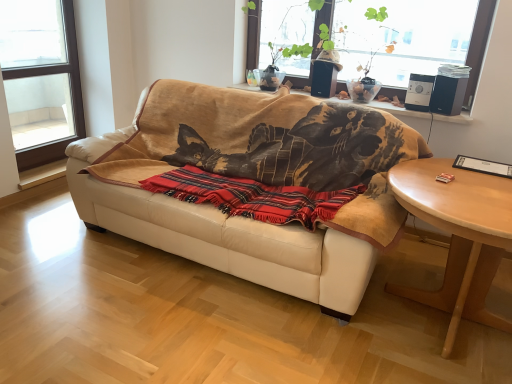
I want to click on beige leather couch at center, so click(241, 217).

You are a GUI agent. You are given a task and a screenshot of the screen. Output one action in this format:
    pyautogui.click(x=<x>, y=<y>)
    Task: Click on the transparent glass window at upper left, the 2th window positioned from the right
    The height and width of the screenshot is (384, 512).
    Given the screenshot: What is the action you would take?
    pyautogui.click(x=69, y=94)

How much space does transparent glass window at upper left, the 2th window positioned from the right, occupy horizontally?

It is 4.31 inches.

This screenshot has height=384, width=512. Identify the location of transparent glass window at upper center, acting as the first window starting from the right. (479, 42).

What is the approximate width of light brown wooden coffee table at lower right?

light brown wooden coffee table at lower right is 3.44 feet in width.

Describe the element at coordinates (252, 196) in the screenshot. I see `red plaid blanket at center` at that location.

Locate an element on the screen. The height and width of the screenshot is (384, 512). wooden window sill at upper center is located at coordinates (399, 110).

Find the location of a particular element. beige leather couch at center is located at coordinates (241, 217).

From a real-world perspective, who is located higher, beige leather couch at center or transparent glass window at upper left, which is counted as the 1th window, starting from the left?

In real-world perspective, transparent glass window at upper left, which is counted as the 1th window, starting from the left, is above.

Is beige leather couch at center in contact with transparent glass window at upper left, which is counted as the 1th window, starting from the left?

No, beige leather couch at center is not touching transparent glass window at upper left, which is counted as the 1th window, starting from the left.

Is beige leather couch at center turned away from transparent glass window at upper left, which is counted as the 1th window, starting from the left?

No, beige leather couch at center is not facing away from transparent glass window at upper left, which is counted as the 1th window, starting from the left.

Can you confirm if transparent glass window at upper left, which is counted as the 1th window, starting from the left, is positioned to the right of wooden window sill at upper center?

In fact, transparent glass window at upper left, which is counted as the 1th window, starting from the left, is to the left of wooden window sill at upper center.

Are transparent glass window at upper left, the 2th window positioned from the right, and wooden window sill at upper center making contact?

There is a gap between transparent glass window at upper left, the 2th window positioned from the right, and wooden window sill at upper center.

Measure the distance from transparent glass window at upper left, the 2th window positioned from the right, to wooden window sill at upper center.

transparent glass window at upper left, the 2th window positioned from the right, and wooden window sill at upper center are 2.78 meters apart from each other.

From a real-world perspective, between transparent glass window at upper left, the 2th window positioned from the right, and red plaid blanket at center, who is vertically higher?

transparent glass window at upper left, the 2th window positioned from the right, from a real-world perspective.

Considering the relative sizes of transparent glass window at upper left, the 2th window positioned from the right, and red plaid blanket at center in the image provided, is transparent glass window at upper left, the 2th window positioned from the right, thinner than red plaid blanket at center?

Yes, transparent glass window at upper left, the 2th window positioned from the right, is thinner than red plaid blanket at center.

Does point (12, 2) lie behind point (276, 203)?

Yes, point (12, 2) is farther from viewer.

Is point (502, 184) positioned before point (361, 229)?

No, it is behind (361, 229).

Is light brown wooden coffee table at lower right shorter than beige leather couch at center?

Yes.

The height and width of the screenshot is (384, 512). What are the coordinates of `studio couch above the light brown wooden coffee table at lower right (from a real-world perspective)` in the screenshot? It's located at (241, 217).

Does light brown wooden coffee table at lower right have a smaller size compared to beige leather couch at center?

Yes.

Is wooden window sill at upper center facing away from transparent glass window at upper left, which is counted as the 1th window, starting from the left?

No, transparent glass window at upper left, which is counted as the 1th window, starting from the left, is not at the back of wooden window sill at upper center.

Is the depth of wooden window sill at upper center greater than that of transparent glass window at upper left, which is counted as the 1th window, starting from the left?

That is False.

How many degrees apart are the facing directions of wooden window sill at upper center and transparent glass window at upper left, the 2th window positioned from the right?

The angle between the facing direction of wooden window sill at upper center and the facing direction of transparent glass window at upper left, the 2th window positioned from the right, is 89.6 degrees.

Considering the sizes of wooden window sill at upper center and transparent glass window at upper left, the 2th window positioned from the right, in the image, is wooden window sill at upper center bigger or smaller than transparent glass window at upper left, the 2th window positioned from the right,?

wooden window sill at upper center is smaller than transparent glass window at upper left, the 2th window positioned from the right.

From a real-world perspective, which is physically below, light brown wooden coffee table at lower right or transparent glass window at upper left, the 2th window positioned from the right?

light brown wooden coffee table at lower right, from a real-world perspective.

Does point (489, 185) lie behind point (46, 142)?

No, (489, 185) is closer to viewer.

Based on the photo, considering the relative sizes of light brown wooden coffee table at lower right and transparent glass window at upper left, the 2th window positioned from the right, in the image provided, is light brown wooden coffee table at lower right bigger than transparent glass window at upper left, the 2th window positioned from the right,?

Indeed, light brown wooden coffee table at lower right has a larger size compared to transparent glass window at upper left, the 2th window positioned from the right.

From the picture: From the image's perspective, which one is positioned higher, wooden window sill at upper center or red plaid blanket at center?

wooden window sill at upper center.

Relative to red plaid blanket at center, is wooden window sill at upper center in front or behind?

In the image, wooden window sill at upper center appears behind red plaid blanket at center.

Consider the image. From a real-world perspective, is wooden window sill at upper center over red plaid blanket at center?

Yes.

Considering the sizes of objects wooden window sill at upper center and red plaid blanket at center in the image provided, who is smaller, wooden window sill at upper center or red plaid blanket at center?

Smaller between the two is wooden window sill at upper center.

The width and height of the screenshot is (512, 384). What are the coordinates of `studio couch directly beneath the transparent glass window at upper left, which is counted as the 1th window, starting from the left (from a real-world perspective)` in the screenshot? It's located at (241, 217).

The width and height of the screenshot is (512, 384). I want to click on window on the left of wooden window sill at upper center, so click(69, 94).

Considering their positions, is light brown wooden coffee table at lower right positioned further to transparent glass window at upper left, the 2th window positioned from the right, than wooden window sill at upper center?

light brown wooden coffee table at lower right is positioned further to the anchor transparent glass window at upper left, the 2th window positioned from the right.

When comparing their distances from transparent glass window at upper left, which is counted as the 1th window, starting from the left, does red plaid blanket at center or wooden window sill at upper center seem further?

wooden window sill at upper center is positioned further to the anchor transparent glass window at upper left, which is counted as the 1th window, starting from the left.

Which object lies further to the anchor point transparent glass window at upper center, which is the 2th window from left to right, light brown wooden coffee table at lower right or transparent glass window at upper left, the 2th window positioned from the right?

transparent glass window at upper left, the 2th window positioned from the right.

From the image, which object appears to be farther from red plaid blanket at center, transparent glass window at upper left, the 2th window positioned from the right, or wooden window sill at upper center?

transparent glass window at upper left, the 2th window positioned from the right, lies further to red plaid blanket at center than the other object.

Based on their spatial positions, is transparent glass window at upper center, which is the 2th window from left to right, or transparent glass window at upper left, which is counted as the 1th window, starting from the left, closer to beige leather couch at center?

transparent glass window at upper center, which is the 2th window from left to right.

Considering their positions, is beige leather couch at center positioned further to red plaid blanket at center than wooden window sill at upper center?

Based on the image, wooden window sill at upper center appears to be further to red plaid blanket at center.

Looking at the image, which one is located closer to transparent glass window at upper center, acting as the first window starting from the right, beige leather couch at center or transparent glass window at upper left, which is counted as the 1th window, starting from the left?

beige leather couch at center is positioned closer to the anchor transparent glass window at upper center, acting as the first window starting from the right.

Looking at the image, which one is located closer to light brown wooden coffee table at lower right, transparent glass window at upper center, acting as the first window starting from the right, or red plaid blanket at center?

red plaid blanket at center.

You are a GUI agent. You are given a task and a screenshot of the screen. Output one action in this format:
    pyautogui.click(x=<x>, y=<y>)
    Task: Click on the studio couch between transparent glass window at upper left, the 2th window positioned from the right, and wooden window sill at upper center
    
    Given the screenshot: What is the action you would take?
    pyautogui.click(x=241, y=217)

At what (x,y) coordinates should I click in order to perform the action: click on studio couch between transparent glass window at upper center, acting as the first window starting from the right, and light brown wooden coffee table at lower right, in the vertical direction. Please return your answer as a coordinate pair (x, y). This screenshot has width=512, height=384. Looking at the image, I should click on pos(241,217).

Where is `window sill between transparent glass window at upper center, which is the 2th window from left to right, and light brown wooden coffee table at lower right in the up-down direction`? Image resolution: width=512 pixels, height=384 pixels. window sill between transparent glass window at upper center, which is the 2th window from left to right, and light brown wooden coffee table at lower right in the up-down direction is located at coordinates (399, 110).

You are a GUI agent. You are given a task and a screenshot of the screen. Output one action in this format:
    pyautogui.click(x=<x>, y=<y>)
    Task: Click on the studio couch between transparent glass window at upper center, acting as the first window starting from the right, and red plaid blanket at center, in the vertical direction
    The height and width of the screenshot is (384, 512).
    Given the screenshot: What is the action you would take?
    pyautogui.click(x=241, y=217)